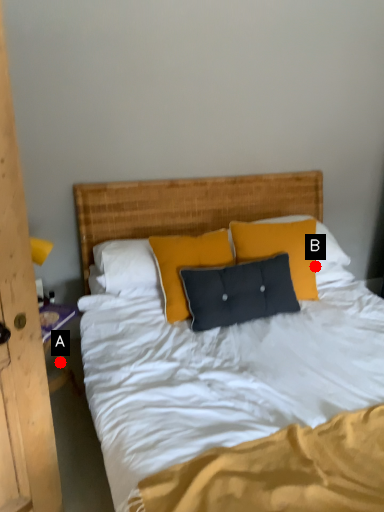
Question: Two points are circled on the image, labeled by A and B beside each circle. Among these points, which one is farthest from the camera?

Choices:
 (A) A is further
 (B) B is further

Answer: (B)